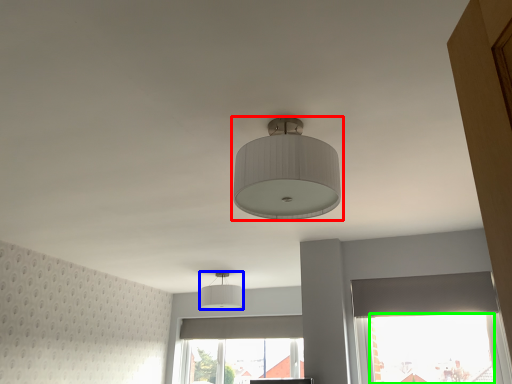
Question: Based on their relative distances, which object is farther from lamp (highlighted by a red box)? Choose from lamp (highlighted by a blue box) and window screen (highlighted by a green box).

Choices:
 (A) lamp
 (B) window screen

Answer: (A)